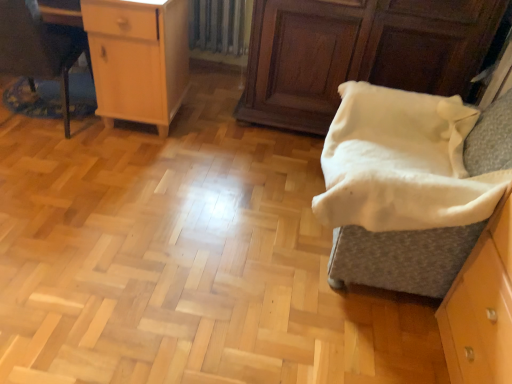
Image resolution: width=512 pixels, height=384 pixels. I want to click on free space to the left of wooden cabinet at upper right, so click(x=208, y=130).